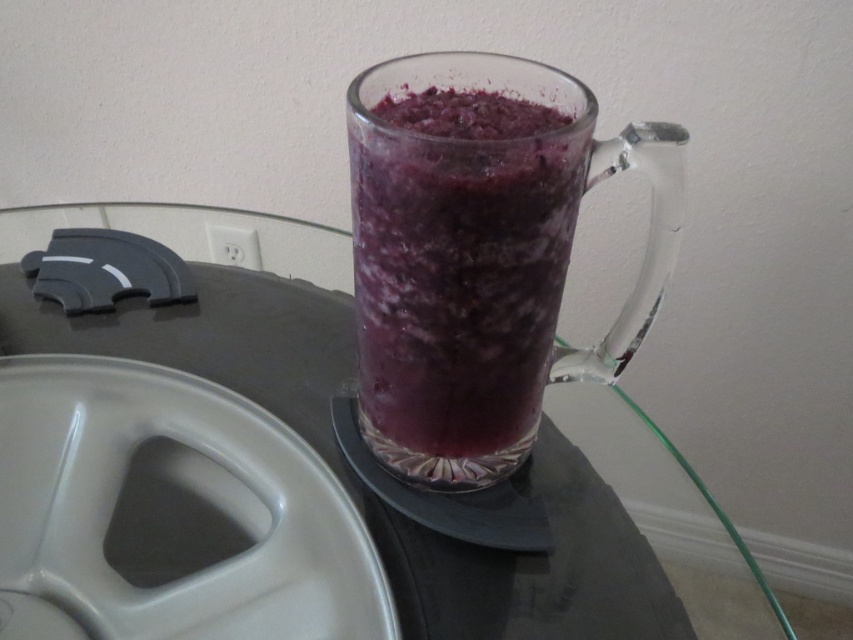
Question: Is purple translucent glass at center positioned before transparent glass table at center?

Choices:
 (A) yes
 (B) no

Answer: (A)

Question: Is purple translucent glass at center behind transparent glass table at center?

Choices:
 (A) yes
 (B) no

Answer: (B)

Question: Which of the following is the closest to the observer?

Choices:
 (A) transparent glass table at center
 (B) purple translucent glass at center

Answer: (B)

Question: Does purple translucent glass at center lie in front of transparent glass table at center?

Choices:
 (A) yes
 (B) no

Answer: (A)